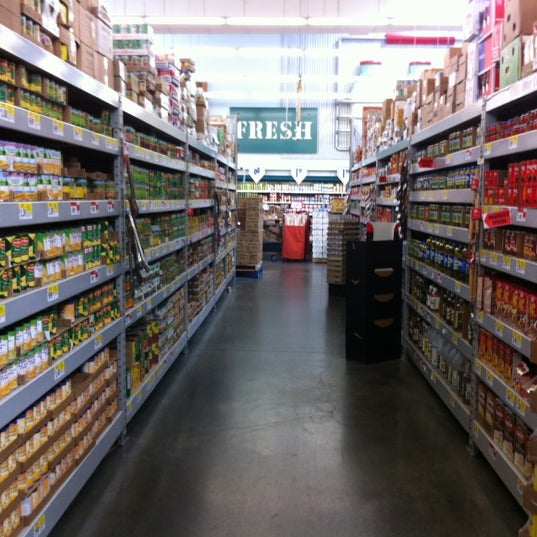
Locate an element on the screen. This screenshot has width=537, height=537. red basket is located at coordinates (292, 240).